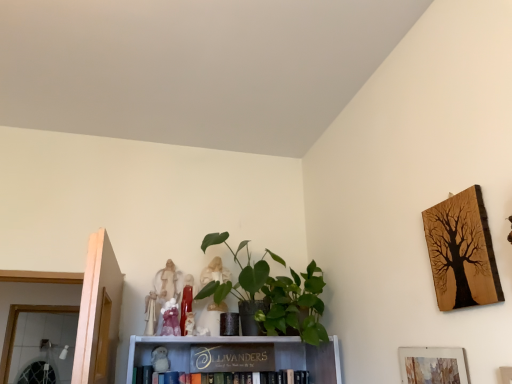
At what (x,y) coordinates should I click in order to perform the action: click on green matte plant at center. Please return your answer as a coordinate pair (x, y). Looking at the image, I should click on (275, 294).

From the picture: In order to face green matte plant at center, should I rotate leftwards or rightwards?

To face it directly, rotate right by 1.163 degrees.

How much space does matte white figurine at center, acting as the second toy starting from the right, occupy vertically?

The height of matte white figurine at center, acting as the second toy starting from the right, is 3.55 inches.

Measure the distance between point (269, 368) and camera.

They are 5.94 feet apart.

I want to click on matte pink porcelain at upper center, positioned as the 4th toy in right-to-left order, so click(x=170, y=319).

The height and width of the screenshot is (384, 512). Describe the element at coordinates (160, 359) in the screenshot. I see `white plush toy at center, the fifth toy from the right` at that location.

You are a GUI agent. You are given a task and a screenshot of the screen. Output one action in this format:
    pyautogui.click(x=<x>, y=<y>)
    Task: Click on the watercolor paper picture frame at lower right, the 1th picture frame ordered from the bottom
    The height and width of the screenshot is (384, 512).
    Given the screenshot: What is the action you would take?
    pyautogui.click(x=432, y=365)

Where is `green matte plant at center`? green matte plant at center is located at coordinates (275, 294).

From the image's perspective, is matte white figurine at center, acting as the second toy starting from the right, under watercolor paper picture frame at lower right, the 1th picture frame ordered from the bottom?

No, from the image's perspective, matte white figurine at center, acting as the second toy starting from the right, is not below watercolor paper picture frame at lower right, the 1th picture frame ordered from the bottom.

Looking at their sizes, would you say matte white figurine at center, acting as the second toy starting from the right, is wider or thinner than watercolor paper picture frame at lower right, the 1th picture frame ordered from the bottom?

In the image, matte white figurine at center, acting as the second toy starting from the right, appears to be wider than watercolor paper picture frame at lower right, the 1th picture frame ordered from the bottom.

Can you tell me how much matte white figurine at center, acting as the second toy starting from the right, and watercolor paper picture frame at lower right, which ranks as the second picture frame in top-to-bottom order, differ in facing direction?

The angular difference between matte white figurine at center, acting as the second toy starting from the right, and watercolor paper picture frame at lower right, which ranks as the second picture frame in top-to-bottom order, is 90 degrees.

Is matte white figurine at center, acting as the second toy starting from the right, smaller than watercolor paper picture frame at lower right, which ranks as the second picture frame in top-to-bottom order?

Yes.

Is white plush toy at center, positioned as the second toy in left-to-right order, aimed at matte white figurine at center, placed as the 1th toy when sorted from right to left?

No, white plush toy at center, positioned as the second toy in left-to-right order, is not aimed at matte white figurine at center, placed as the 1th toy when sorted from right to left.

From the picture: Is the surface of white plush toy at center, the fifth toy from the right, in direct contact with matte white figurine at center, placed as the sixth toy when sorted from left to right?

No.

Considering the positions of objects white plush toy at center, positioned as the second toy in left-to-right order, and matte white figurine at center, placed as the 1th toy when sorted from right to left, in the image provided, who is behind, white plush toy at center, positioned as the second toy in left-to-right order, or matte white figurine at center, placed as the 1th toy when sorted from right to left,?

matte white figurine at center, placed as the 1th toy when sorted from right to left, is further away from the camera.

Considering the positions of objects gold metallic sign at center, placed as the first book when sorted from top to bottom, and matte white figurine at center, the fifth toy when ordered from left to right, in the image provided, who is more to the right, gold metallic sign at center, placed as the first book when sorted from top to bottom, or matte white figurine at center, the fifth toy when ordered from left to right,?

gold metallic sign at center, placed as the first book when sorted from top to bottom.

From the picture: From the image's perspective, is gold metallic sign at center, the 2th book in the bottom-to-top sequence, on matte white figurine at center, the fifth toy when ordered from left to right?

No, from the image's perspective, gold metallic sign at center, the 2th book in the bottom-to-top sequence, is not above matte white figurine at center, the fifth toy when ordered from left to right.

Can you confirm if gold metallic sign at center, the 2th book in the bottom-to-top sequence, is shorter than matte white figurine at center, the fifth toy when ordered from left to right?

No.

Could you tell me if gold metallic sign at center, placed as the first book when sorted from top to bottom, is facing matte white figurine at center, acting as the second toy starting from the right?

No, gold metallic sign at center, placed as the first book when sorted from top to bottom, is not facing towards matte white figurine at center, acting as the second toy starting from the right.

Can you confirm if matte white figurine at center, which is the 3th toy in right-to-left order, is positioned to the left of matte pink porcelain at upper center, marked as the third toy in a left-to-right arrangement?

In fact, matte white figurine at center, which is the 3th toy in right-to-left order, is to the right of matte pink porcelain at upper center, marked as the third toy in a left-to-right arrangement.

Is matte pink porcelain at upper center, positioned as the 4th toy in right-to-left order, located within matte white figurine at center, which appears as the fourth toy when viewed from the left?

That's incorrect, matte pink porcelain at upper center, positioned as the 4th toy in right-to-left order, is not inside matte white figurine at center, which appears as the fourth toy when viewed from the left.

Is matte white figurine at center, which appears as the fourth toy when viewed from the left, aimed at matte pink porcelain at upper center, marked as the third toy in a left-to-right arrangement?

No.

Is matte pink porcelain at upper center, positioned as the 4th toy in right-to-left order, inside or outside of matte white figurine at center, placed as the sixth toy when sorted from left to right?

matte pink porcelain at upper center, positioned as the 4th toy in right-to-left order, lies outside matte white figurine at center, placed as the sixth toy when sorted from left to right.

Which object is thinner, matte pink porcelain at upper center, positioned as the 4th toy in right-to-left order, or matte white figurine at center, placed as the 1th toy when sorted from right to left?

Thinner between the two is matte pink porcelain at upper center, positioned as the 4th toy in right-to-left order.

Which of these two, matte pink porcelain at upper center, positioned as the 4th toy in right-to-left order, or matte white figurine at center, placed as the sixth toy when sorted from left to right, is bigger?

matte white figurine at center, placed as the sixth toy when sorted from left to right, is bigger.

Consider the image. Is there a large distance between matte pink porcelain at upper center, positioned as the 4th toy in right-to-left order, and matte white figurine at center, placed as the 1th toy when sorted from right to left?

matte pink porcelain at upper center, positioned as the 4th toy in right-to-left order, is actually quite close to matte white figurine at center, placed as the 1th toy when sorted from right to left.

From the image's perspective, between green matte plant at center and white fabric angel at upper center, arranged as the 1th toy when viewed from the left, which one is located above?

green matte plant at center.

From a real-world perspective, is green matte plant at center physically above white fabric angel at upper center, which is the sixth toy in right-to-left order?

Correct, in the physical world, green matte plant at center is higher than white fabric angel at upper center, which is the sixth toy in right-to-left order.

Between point (277, 315) and point (147, 298), which one is positioned behind?

The point (147, 298) is more distant.

In the image, is green matte plant at center positioned in front of or behind white fabric angel at upper center, arranged as the 1th toy when viewed from the left?

green matte plant at center is in front of white fabric angel at upper center, arranged as the 1th toy when viewed from the left.

Between white plush toy at center, the fifth toy from the right, and wooden tree art at upper right, arranged as the first picture frame when viewed from the top, which one has more height?

With more height is wooden tree art at upper right, arranged as the first picture frame when viewed from the top.

Does point (163, 350) come in front of point (480, 244)?

No, it is behind (480, 244).

From a real-world perspective, which object rests below the other?

white plush toy at center, the fifth toy from the right.

Locate an element on the screen. The width and height of the screenshot is (512, 384). the 1st toy above when counting from the watercolor paper picture frame at lower right, which ranks as the second picture frame in top-to-bottom order (from the image's perspective) is located at coordinates (189, 323).

Starting from the matte white figurine at center, placed as the sixth toy when sorted from left to right, which toy is the 4th one to the left? Please provide its 2D coordinates.

[(160, 359)]

Considering their positions, is matte white figurine at center, placed as the 1th toy when sorted from right to left, positioned further to matte white figurine at center, which is the 3th toy in right-to-left order, than white fabric angel at upper center, which is the sixth toy in right-to-left order?

white fabric angel at upper center, which is the sixth toy in right-to-left order.

Based on the photo, from the image, which object appears to be farther from gold metallic sign at center, placed as the first book when sorted from top to bottom, matte white figurine at center, which is the 3th toy in right-to-left order, or white fabric angel at upper center, which is the sixth toy in right-to-left order?

The object further to gold metallic sign at center, placed as the first book when sorted from top to bottom, is white fabric angel at upper center, which is the sixth toy in right-to-left order.

When comparing their distances from matte white figurine at center, which appears as the fourth toy when viewed from the left, does gold metallic sign at center, placed as the first book when sorted from top to bottom, or matte white figurine at center, the fifth toy when ordered from left to right, seem further?

gold metallic sign at center, placed as the first book when sorted from top to bottom, is positioned further to the anchor matte white figurine at center, which appears as the fourth toy when viewed from the left.

Looking at the image, which one is located closer to matte white figurine at center, acting as the second toy starting from the right, white plush toy at center, positioned as the second toy in left-to-right order, or matte pink porcelain at upper center, marked as the third toy in a left-to-right arrangement?

matte pink porcelain at upper center, marked as the third toy in a left-to-right arrangement, lies closer to matte white figurine at center, acting as the second toy starting from the right, than the other object.

Based on their spatial positions, is wooden tree art at upper right, arranged as the first picture frame when viewed from the top, or matte white figurine at center, acting as the second toy starting from the right, further from wooden sign at center, the 2th book viewed from the top?

wooden tree art at upper right, arranged as the first picture frame when viewed from the top, lies further to wooden sign at center, the 2th book viewed from the top, than the other object.

Based on their spatial positions, is gold metallic sign at center, placed as the first book when sorted from top to bottom, or white plush toy at center, the fifth toy from the right, closer to white fabric angel at upper center, arranged as the 1th toy when viewed from the left?

white plush toy at center, the fifth toy from the right.

From the image, which object appears to be farther from matte white figurine at center, the fifth toy when ordered from left to right, gold metallic sign at center, placed as the first book when sorted from top to bottom, or white fabric angel at upper center, which is the sixth toy in right-to-left order?

Among the two, gold metallic sign at center, placed as the first book when sorted from top to bottom, is located further to matte white figurine at center, the fifth toy when ordered from left to right.

Considering their positions, is matte white figurine at center, which is the 3th toy in right-to-left order, positioned further to matte pink porcelain at upper center, positioned as the 4th toy in right-to-left order, than wooden sign at center, the first book positioned from the bottom?

Among the two, wooden sign at center, the first book positioned from the bottom, is located further to matte pink porcelain at upper center, positioned as the 4th toy in right-to-left order.

You are a GUI agent. You are given a task and a screenshot of the screen. Output one action in this format:
    pyautogui.click(x=<x>, y=<y>)
    Task: Click on the picture frame between green matte plant at center and wooden tree art at upper right, arranged as the first picture frame when viewed from the top
    Image resolution: width=512 pixels, height=384 pixels.
    Given the screenshot: What is the action you would take?
    pyautogui.click(x=432, y=365)

Locate an element on the screen. The height and width of the screenshot is (384, 512). book between matte white figurine at center, placed as the sixth toy when sorted from left to right, and wooden sign at center, the first book positioned from the bottom, vertically is located at coordinates (232, 358).

Where is `houseplant located between wooden tree art at upper right, marked as the second picture frame in a bottom-to-top arrangement, and gold metallic sign at center, placed as the first book when sorted from top to bottom, in the depth direction`? houseplant located between wooden tree art at upper right, marked as the second picture frame in a bottom-to-top arrangement, and gold metallic sign at center, placed as the first book when sorted from top to bottom, in the depth direction is located at coordinates (275, 294).

Locate an element on the screen. The image size is (512, 384). houseplant located between matte white figurine at center, which is the 3th toy in right-to-left order, and wooden tree art at upper right, marked as the second picture frame in a bottom-to-top arrangement, in the left-right direction is located at coordinates (275, 294).